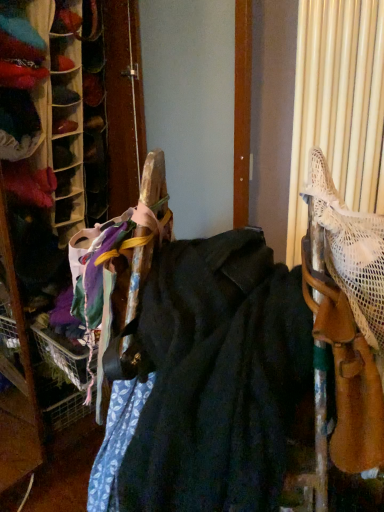
Question: Considering the positions of velvet-like fabric at center, the 2th wide positioned from the right, and white mesh bag at right, the first wide from the right, in the image, is velvet-like fabric at center, the 2th wide positioned from the right, wider or thinner than white mesh bag at right, the first wide from the right,?

Choices:
 (A) wide
 (B) thin

Answer: (A)

Question: In the image, is velvet-like fabric at center, which ranks as the 1th wide in left-to-right order, positioned in front of or behind white mesh bag at right, the first wide from the right?

Choices:
 (A) front
 (B) behind

Answer: (A)

Question: From their relative heights in the image, would you say velvet-like fabric at center, which ranks as the 1th wide in left-to-right order, is taller or shorter than white mesh bag at right, the first wide from the right?

Choices:
 (A) tall
 (B) short

Answer: (A)

Question: From their relative heights in the image, would you say white mesh bag at right, the first wide from the right, is taller or shorter than velvet-like fabric at center, the 2th wide positioned from the right?

Choices:
 (A) tall
 (B) short

Answer: (B)

Question: Based on their sizes in the image, would you say white mesh bag at right, the first wide from the right, is bigger or smaller than velvet-like fabric at center, which ranks as the 1th wide in left-to-right order?

Choices:
 (A) small
 (B) big

Answer: (A)

Question: Choose the correct answer: Is white mesh bag at right, the 2th wide in the left-to-right sequence, inside velvet-like fabric at center, which ranks as the 1th wide in left-to-right order, or outside it?

Choices:
 (A) inside
 (B) outside

Answer: (B)

Question: Looking at their shapes, would you say white mesh bag at right, the 2th wide in the left-to-right sequence, is wider or thinner than velvet-like fabric at center, which ranks as the 1th wide in left-to-right order?

Choices:
 (A) wide
 (B) thin

Answer: (B)